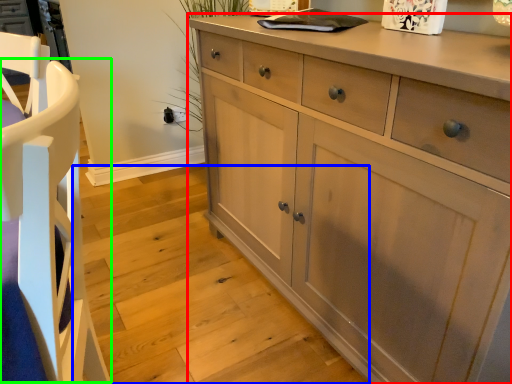
Question: Which object is the farthest from chest of drawers (highlighted by a red box)? Choose among these: stair (highlighted by a blue box) or armchair (highlighted by a green box).

Choices:
 (A) stair
 (B) armchair

Answer: (B)